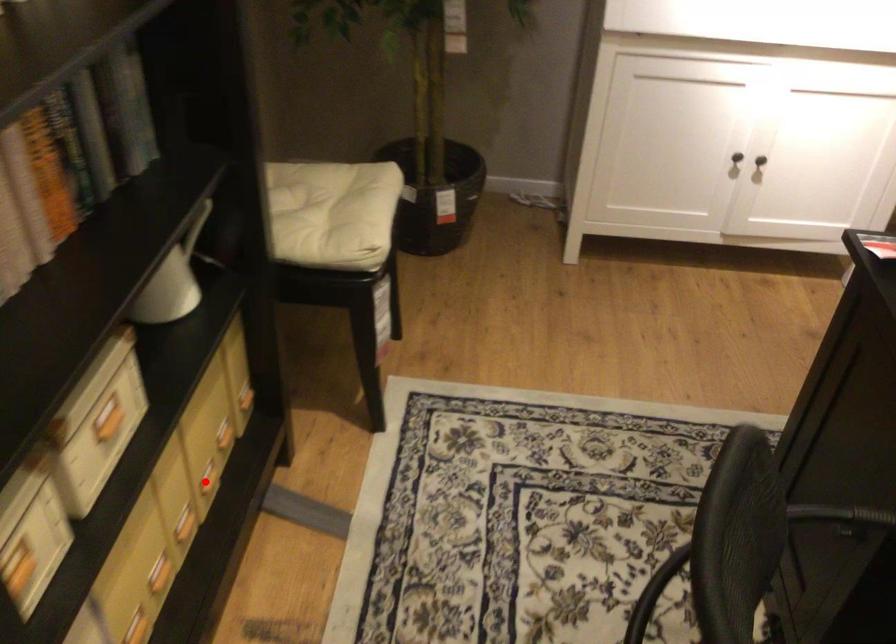
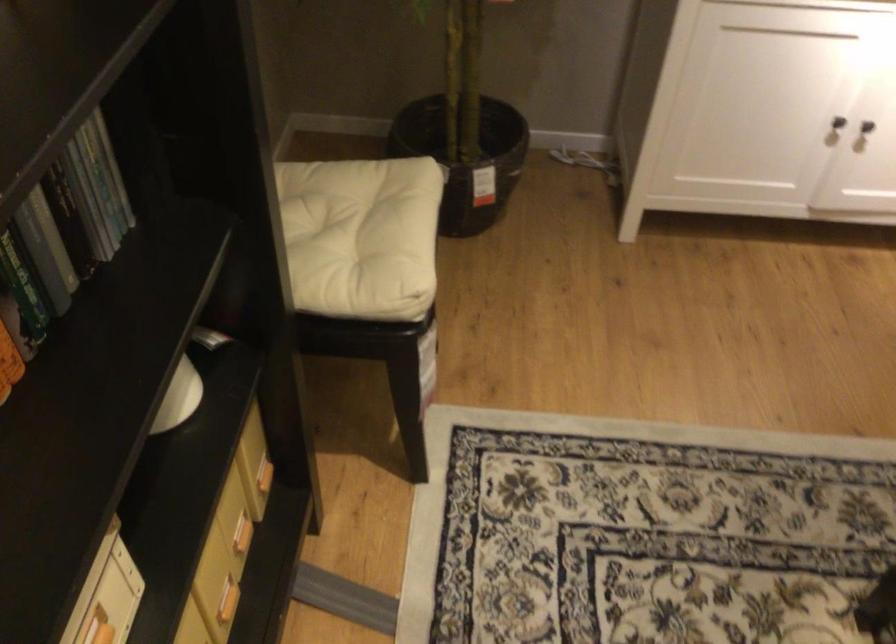
Where in the second image is the point corresponding to the highlighted location from the first image?

(227, 601)